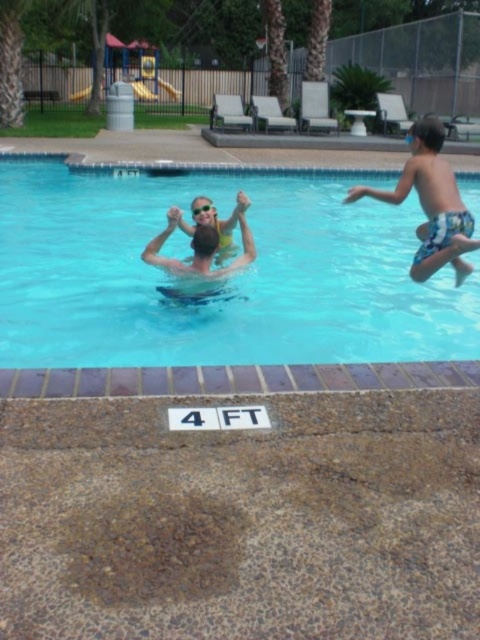
Does clear blue water at center appear under clear plastic goggles at upper center?

No, clear blue water at center is not below clear plastic goggles at upper center.

Is the position of clear blue water at center less distant than that of clear plastic goggles at upper center?

No, it is behind clear plastic goggles at upper center.

Measure the distance between clear blue water at center and camera.

A distance of 9.94 meters exists between clear blue water at center and camera.

Where is `clear blue water at center`? clear blue water at center is located at coordinates (228, 280).

At what (x,y) coordinates should I click in order to perform the action: click on blue printed trunks at right. Please return your answer as a coordinate pair (x, y). Image resolution: width=480 pixels, height=640 pixels. Looking at the image, I should click on (431, 204).

Does point (411, 128) lie behind point (196, 209)?

That is True.

Is point (433, 138) farther from camera compared to point (202, 209)?

No, it is not.

Where is `blue printed trunks at right`? Image resolution: width=480 pixels, height=640 pixels. blue printed trunks at right is located at coordinates (431, 204).

Is clear blue water at center wider than blue printed trunks at right?

No, clear blue water at center is not wider than blue printed trunks at right.

Which of these two, clear blue water at center or blue printed trunks at right, stands shorter?

With less height is clear blue water at center.

The height and width of the screenshot is (640, 480). What do you see at coordinates (228, 280) in the screenshot? I see `clear blue water at center` at bounding box center [228, 280].

Where is `clear blue water at center`? clear blue water at center is located at coordinates (x=228, y=280).